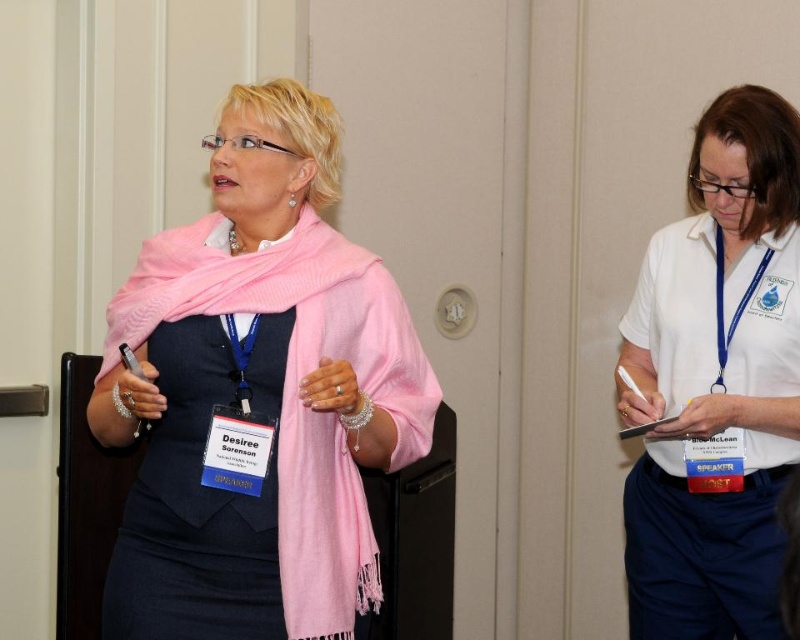
Is pink wool scarf at center shorter than white smooth shirt at right?

Yes, pink wool scarf at center is shorter than white smooth shirt at right.

Measure the distance between pink wool scarf at center and white smooth shirt at right.

34.00 inches

Who is more distant from viewer, [297,202] or [624,538]?

Positioned behind is point [624,538].

Where is `pink wool scarf at center`? The image size is (800, 640). pink wool scarf at center is located at coordinates (258, 394).

Is white smooth shirt at right in front of black satin dress at center?

That is False.

Locate an element on the screen. white smooth shirt at right is located at coordinates (716, 381).

Is point (362, 340) farther from viewer compared to point (262, 598)?

Yes, point (362, 340) is behind point (262, 598).

Between pink wool scarf at center and black satin dress at center, which one is positioned lower?

black satin dress at center is below.

Between point (252, 148) and point (276, 618), which one is positioned in front?

Point (276, 618)

Identify the location of pink wool scarf at center. (258, 394).